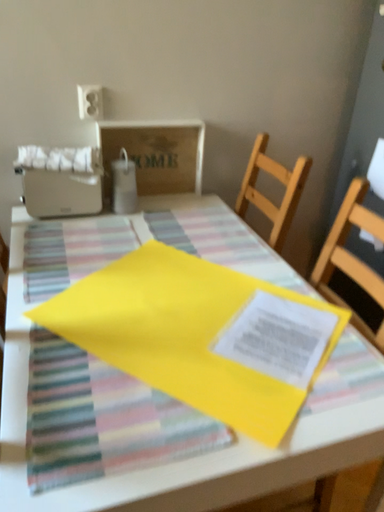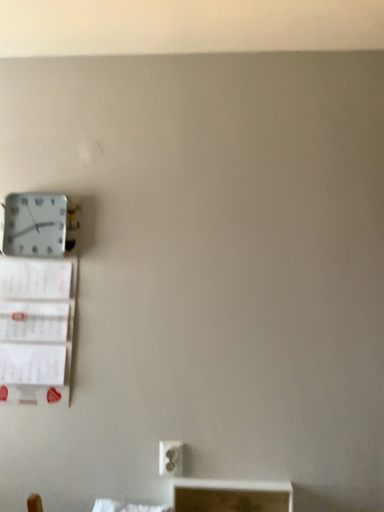
Question: How did the camera likely rotate when shooting the video?

Choices:
 (A) rotated upward
 (B) rotated downward

Answer: (A)